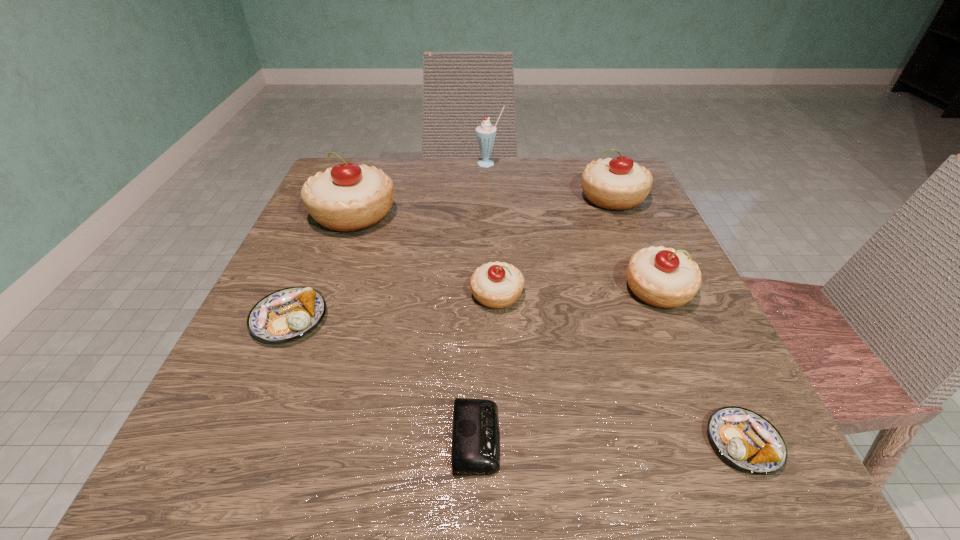
In the image, there is a desktop. At what (x,y) coordinates should I click in order to perform the action: click on free space at the left edge. Please return your answer as a coordinate pair (x, y). The height and width of the screenshot is (540, 960). Looking at the image, I should click on (319, 396).

Identify the location of blank area at the right edge. This screenshot has height=540, width=960. (677, 320).

Locate an element on the screen. vacant space at the near left corner of the desktop is located at coordinates (294, 468).

Identify the location of vacant area at the far right corner of the desktop. (636, 209).

In the image, there is a desktop. Where is `vacant space at the near right corner`? vacant space at the near right corner is located at coordinates (791, 490).

At what (x,y) coordinates should I click in order to perform the action: click on vacant point located between the third smallest beige pastry and the smallest beige pastry. Please return your answer as a coordinate pair (x, y). The height and width of the screenshot is (540, 960). Looking at the image, I should click on (555, 246).

I want to click on free space that is in between the white milkshake and the tallest pastry, so click(x=421, y=188).

Image resolution: width=960 pixels, height=540 pixels. I want to click on vacant area that lies between the smaller brown pastry and the third pastry from left to right, so [620, 369].

I want to click on free space between the farthest object and the fifth shortest object, so click(574, 227).

Find the location of `vacant point located between the alarm clock and the second beige pastry from left to right`. vacant point located between the alarm clock and the second beige pastry from left to right is located at coordinates (487, 367).